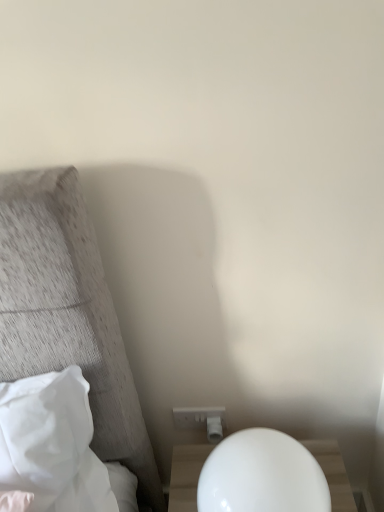
What do you see at coordinates (200, 417) in the screenshot? The width and height of the screenshot is (384, 512). I see `white plastic electric outlet at lower center` at bounding box center [200, 417].

What do you see at coordinates (44, 433) in the screenshot?
I see `white soft pillow at left` at bounding box center [44, 433].

Locate an element on the screen. white plastic electric outlet at lower center is located at coordinates (200, 417).

Which object is positioned more to the right, white plastic electric outlet at lower center or white glossy nightstand at lower right?

white glossy nightstand at lower right is more to the right.

Does white plastic electric outlet at lower center have a greater height compared to white glossy nightstand at lower right?

No, white plastic electric outlet at lower center is not taller than white glossy nightstand at lower right.

From a real-world perspective, who is located lower, white plastic electric outlet at lower center or white glossy nightstand at lower right?

In real-world perspective, white plastic electric outlet at lower center is lower.

Is white plastic electric outlet at lower center positioned with its back to white glossy nightstand at lower right?

No, white plastic electric outlet at lower center is not facing the opposite direction of white glossy nightstand at lower right.

Which object is positioned more to the right, white glossy nightstand at lower right or white soft pillow at left?

white glossy nightstand at lower right is more to the right.

Looking at this image, is white glossy nightstand at lower right bigger or smaller than white soft pillow at left?

Considering their sizes, white glossy nightstand at lower right takes up less space than white soft pillow at left.

From the image's perspective, is white glossy nightstand at lower right located above or below white soft pillow at left?

Clearly, from the image's perspective, white glossy nightstand at lower right is below white soft pillow at left.

Which is behind, white soft pillow at left or white glossy nightstand at lower right?

white soft pillow at left.

Is white soft pillow at left positioned far away from white glossy nightstand at lower right?

They are positioned close to each other.

Can you confirm if white soft pillow at left is smaller than white glossy nightstand at lower right?

Incorrect, white soft pillow at left is not smaller in size than white glossy nightstand at lower right.

From the image's perspective, does white soft pillow at left appear higher than white glossy nightstand at lower right?

Correct, white soft pillow at left appears higher than white glossy nightstand at lower right in the image.

From a real-world perspective, is white plastic electric outlet at lower center positioned above or below white soft pillow at left?

From a real-world perspective, white plastic electric outlet at lower center is physically below white soft pillow at left.

Is white plastic electric outlet at lower center wider or thinner than white soft pillow at left?

Clearly, white plastic electric outlet at lower center has less width compared to white soft pillow at left.

In the scene shown: Is white plastic electric outlet at lower center not inside white soft pillow at left?

Yes.

Is white soft pillow at left shorter than white plastic electric outlet at lower center?

No, white soft pillow at left is not shorter than white plastic electric outlet at lower center.

Considering the relative sizes of white soft pillow at left and white plastic electric outlet at lower center in the image provided, is white soft pillow at left bigger than white plastic electric outlet at lower center?

Indeed, white soft pillow at left has a larger size compared to white plastic electric outlet at lower center.

Is white soft pillow at left wider or thinner than white plastic electric outlet at lower center?

Considering their sizes, white soft pillow at left looks broader than white plastic electric outlet at lower center.

You are a GUI agent. You are given a task and a screenshot of the screen. Output one action in this format:
    pyautogui.click(x=<x>, y=<y>)
    Task: Click on the pillow above the white plastic electric outlet at lower center (from a real-world perspective)
    The height and width of the screenshot is (512, 384).
    Given the screenshot: What is the action you would take?
    pyautogui.click(x=44, y=433)

From a real-world perspective, which is physically above, white glossy nightstand at lower right or white plastic electric outlet at lower center?

From a 3D spatial view, white glossy nightstand at lower right is above.

Between white glossy nightstand at lower right and white plastic electric outlet at lower center, which one has smaller width?

With smaller width is white plastic electric outlet at lower center.

From the image's perspective, who appears lower, white glossy nightstand at lower right or white plastic electric outlet at lower center?

white plastic electric outlet at lower center, from the image's perspective.

You are a GUI agent. You are given a task and a screenshot of the screen. Output one action in this format:
    pyautogui.click(x=<x>, y=<y>)
    Task: Click on the nightstand in front of the white plastic electric outlet at lower center
    The height and width of the screenshot is (512, 384).
    Given the screenshot: What is the action you would take?
    pyautogui.click(x=186, y=476)

Where is `nightstand below the white soft pillow at left (from the image's perspective)`? This screenshot has width=384, height=512. nightstand below the white soft pillow at left (from the image's perspective) is located at coordinates (186, 476).

When comparing their distances from white soft pillow at left, does white glossy nightstand at lower right or white plastic electric outlet at lower center seem further?

The object further to white soft pillow at left is white plastic electric outlet at lower center.

Considering their positions, is white plastic electric outlet at lower center positioned further to white soft pillow at left than white glossy nightstand at lower right?

white plastic electric outlet at lower center is positioned further to the anchor white soft pillow at left.

Which object lies further to the anchor point white plastic electric outlet at lower center, white soft pillow at left or white glossy nightstand at lower right?

white soft pillow at left is positioned further to the anchor white plastic electric outlet at lower center.

Considering their positions, is white glossy nightstand at lower right positioned closer to white plastic electric outlet at lower center than white soft pillow at left?

Based on the image, white glossy nightstand at lower right appears to be nearer to white plastic electric outlet at lower center.

Based on their spatial positions, is white soft pillow at left or white plastic electric outlet at lower center closer to white glossy nightstand at lower right?

white plastic electric outlet at lower center.

Looking at the image, which one is located closer to white glossy nightstand at lower right, white plastic electric outlet at lower center or white soft pillow at left?

white plastic electric outlet at lower center lies closer to white glossy nightstand at lower right than the other object.

Locate an element on the screen. This screenshot has height=512, width=384. pillow between white glossy nightstand at lower right and white plastic electric outlet at lower center along the z-axis is located at coordinates (44, 433).